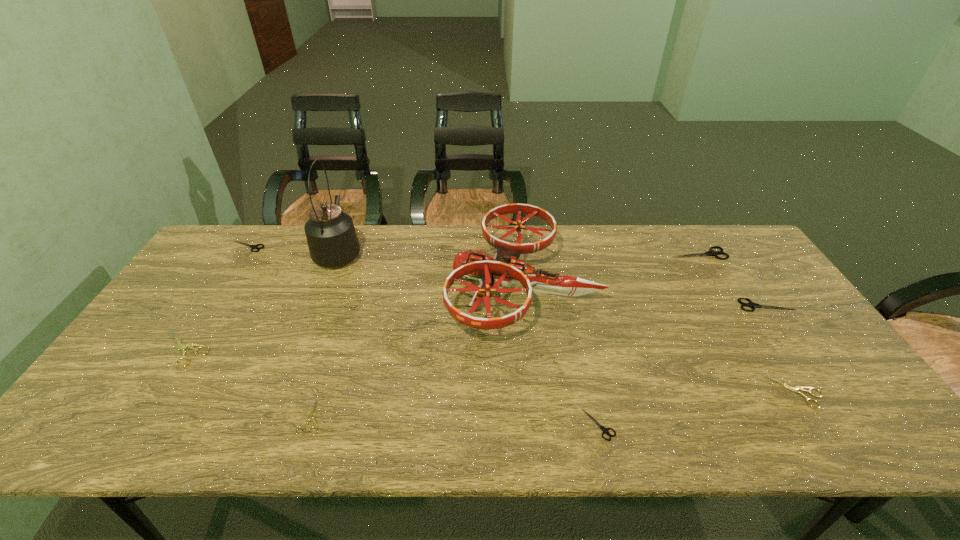
Identify the location of free space at the far left corner of the desktop. (249, 242).

What are the coordinates of `vacant region at the far right corner of the desktop` in the screenshot? It's located at (747, 256).

Where is `blank region between the third biggest black shears and the drone`? This screenshot has height=540, width=960. blank region between the third biggest black shears and the drone is located at coordinates (385, 266).

The width and height of the screenshot is (960, 540). Find the location of `vacant region between the third biggest black shears and the nearest black shears`. vacant region between the third biggest black shears and the nearest black shears is located at coordinates (423, 335).

Find the location of a particular element. The image size is (960, 540). free spot between the rightmost beige shears and the tallest object is located at coordinates (568, 322).

The image size is (960, 540). In order to click on vacant area that lies between the leftmost black shears and the kettle in this screenshot , I will do `click(293, 249)`.

Locate an element on the screen. This screenshot has height=540, width=960. vacant space that's between the red drone and the rightmost beige shears is located at coordinates (660, 339).

Where is `unoccupied area between the biggest black shears and the leftmost black shears`? Image resolution: width=960 pixels, height=540 pixels. unoccupied area between the biggest black shears and the leftmost black shears is located at coordinates (472, 250).

Locate an element on the screen. The height and width of the screenshot is (540, 960). free space between the biggest black shears and the second tallest object is located at coordinates (611, 269).

You are a GUI agent. You are given a task and a screenshot of the screen. Output one action in this format:
    pyautogui.click(x=<x>, y=<y>)
    Task: Click on the free space between the red drone and the seventh shortest object
    This screenshot has width=960, height=540.
    Given the screenshot: What is the action you would take?
    pyautogui.click(x=611, y=269)